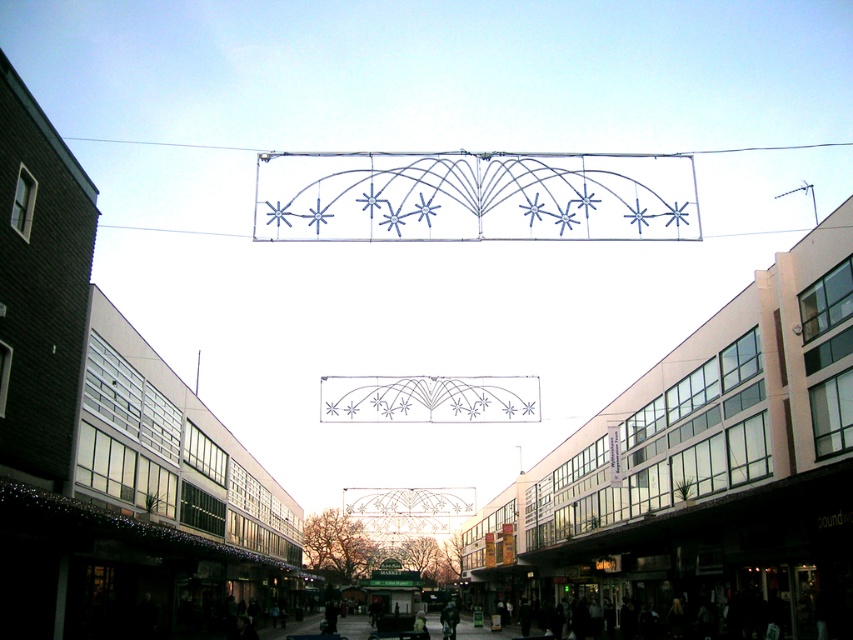
Question: Is metallic glass building at center positioned in front of metallic wireframe at upper center?

Choices:
 (A) yes
 (B) no

Answer: (B)

Question: Does metallic glass building at center have a greater width compared to metallic wireframe at upper center?

Choices:
 (A) no
 (B) yes

Answer: (B)

Question: Which object is farther from the camera taking this photo?

Choices:
 (A) metallic glass building at center
 (B) metallic wireframe at upper center

Answer: (A)

Question: Does metallic glass building at center appear under metallic wireframe at upper center?

Choices:
 (A) no
 (B) yes

Answer: (B)

Question: Which point is closer to the camera taking this photo?

Choices:
 (A) (698, 484)
 (B) (74, 189)

Answer: (B)